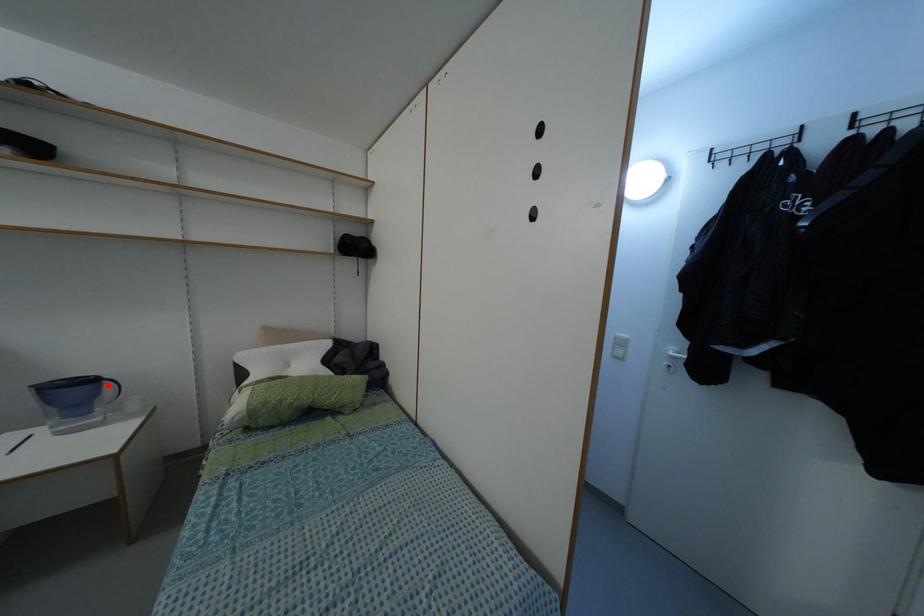
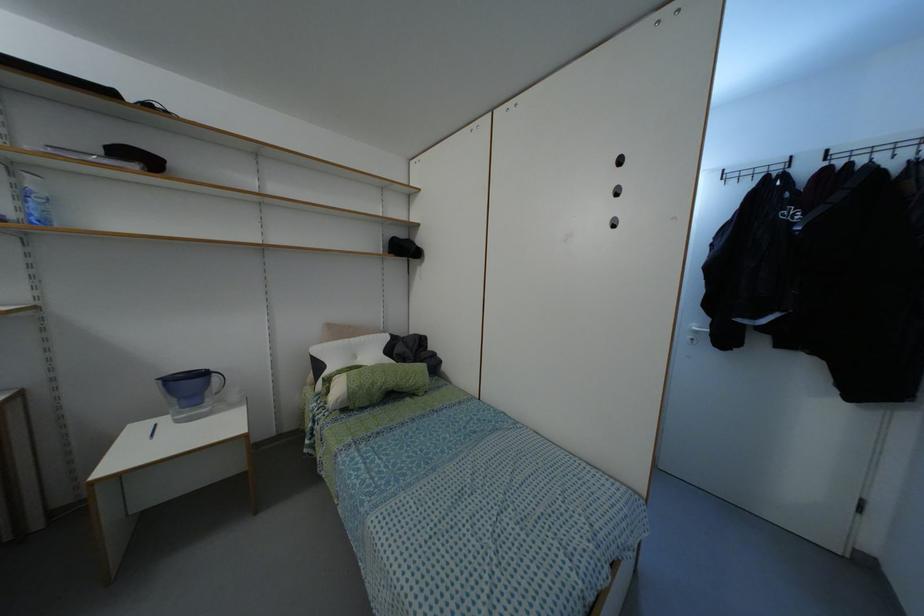
In the second image, find the point that corresponds to the highlighted location in the first image.

(214, 378)